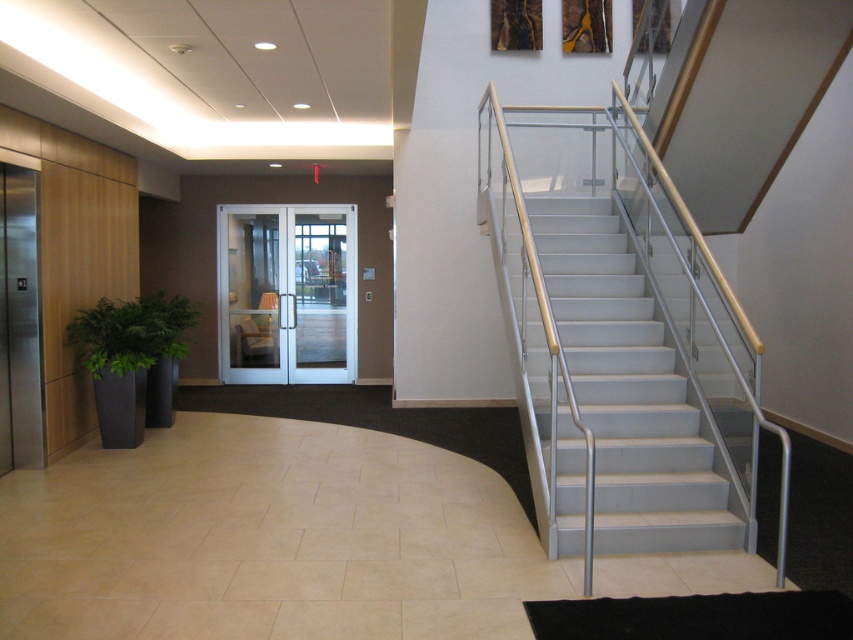
Which is above, white glass elevator at center or green leafy plant at left?

Positioned higher is white glass elevator at center.

Which is more to the right, white glass elevator at center or green leafy plant at left?

white glass elevator at center

Find the location of a particular element. white glass elevator at center is located at coordinates (287, 292).

At what (x,y) coordinates should I click in order to perform the action: click on white glass elevator at center. Please return your answer as a coordinate pair (x, y). Image resolution: width=853 pixels, height=640 pixels. Looking at the image, I should click on (287, 292).

Is point (534, 240) closer to camera compared to point (268, 308)?

That is True.

Is white glossy stairs at right behind white glass elevator at center?

No, white glossy stairs at right is in front of white glass elevator at center.

Describe the element at coordinates (631, 392) in the screenshot. I see `white glossy stairs at right` at that location.

I want to click on white glossy stairs at right, so click(631, 392).

Which is behind, point (598, 496) or point (167, 353)?

The point (167, 353) is more distant.

Does white glossy stairs at right appear on the left side of green leafy plant at left?

Incorrect, white glossy stairs at right is not on the left side of green leafy plant at left.

Is point (589, 227) closer to camera compared to point (97, 304)?

That is True.

Identify the location of white glossy stairs at right. Image resolution: width=853 pixels, height=640 pixels. (631, 392).